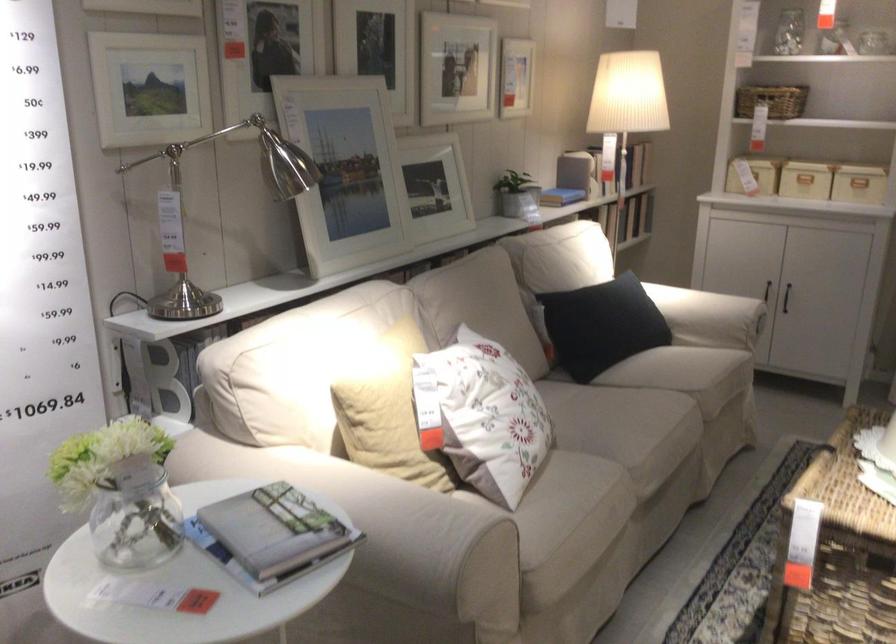
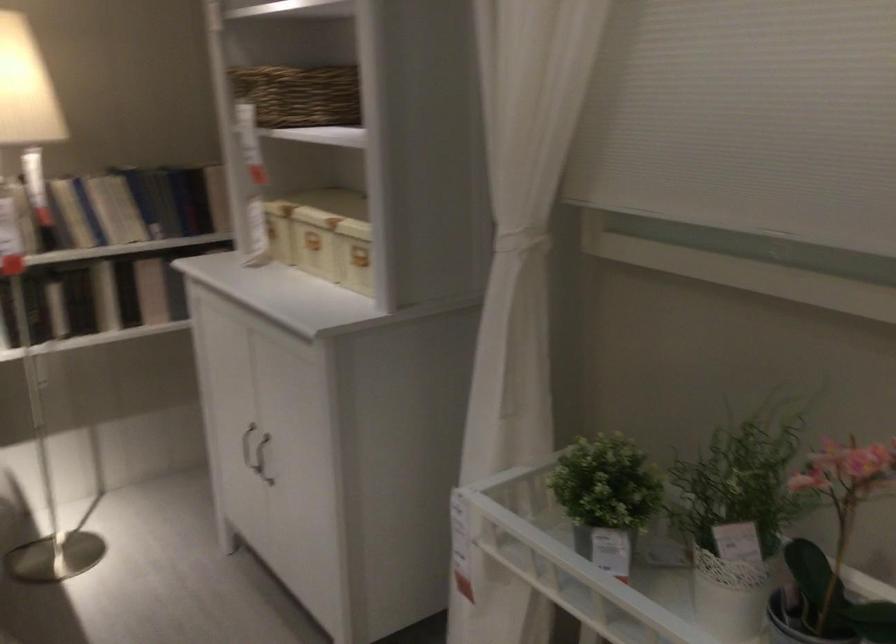
Find the pixel in the second image that matches point 812,71 in the first image.

(298, 93)